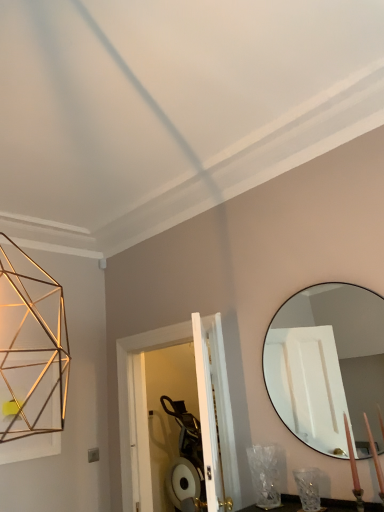
Question: Is matte black mirror at right in front of or behind candle at lower right in the image?

Choices:
 (A) front
 (B) behind

Answer: (B)

Question: From their relative heights in the image, would you say matte black mirror at right is taller or shorter than candle at lower right?

Choices:
 (A) short
 (B) tall

Answer: (B)

Question: Which is nearer to the candle at lower right?

Choices:
 (A) clear glass vase at lower right
 (B) matte black mirror at right

Answer: (A)

Question: Considering the real-world distances, which object is farthest from the clear glass vase at lower right?

Choices:
 (A) candle at lower right
 (B) matte black mirror at right

Answer: (B)